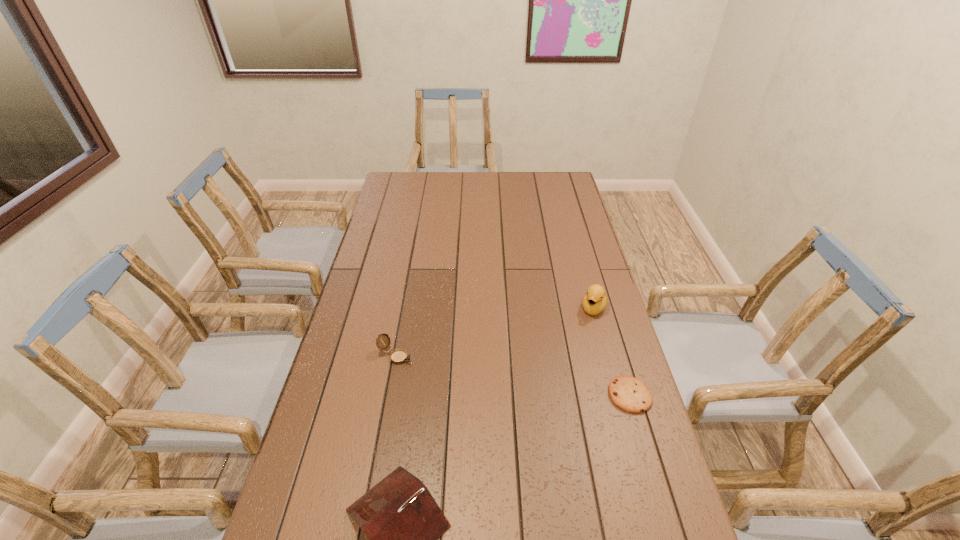
Where is `the shortest object`? the shortest object is located at coordinates (630, 394).

This screenshot has height=540, width=960. Find the location of `the third farthest object`. the third farthest object is located at coordinates click(630, 394).

Locate an element on the screen. The image size is (960, 540). duckling is located at coordinates (595, 300).

Find the location of a particular element. This screenshot has height=540, width=960. the tallest object is located at coordinates (595, 300).

You are a GUI agent. You are given a task and a screenshot of the screen. Output one action in this format:
    pyautogui.click(x=<x>, y=<y>)
    Task: Click on the compass
    
    Given the screenshot: What is the action you would take?
    coord(398,356)

Locate an element on the screen. This screenshot has width=960, height=540. vacant space located on the back of the third farthest object is located at coordinates (618, 356).

Where is `vacant space positioned 0.090m facing forward on the farthest object`? This screenshot has height=540, width=960. vacant space positioned 0.090m facing forward on the farthest object is located at coordinates (581, 337).

Find the location of a particular element. free space located facing forward on the farthest object is located at coordinates (584, 330).

Find the location of `free space located facing forward on the farthest object`. free space located facing forward on the farthest object is located at coordinates (568, 363).

Locate an element on the screen. This screenshot has height=540, width=960. vacant space located 0.190m on the face of the compass is located at coordinates (464, 389).